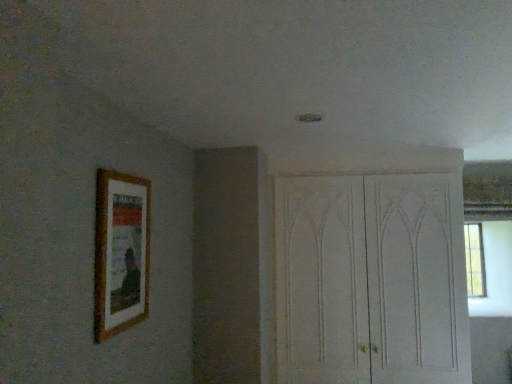
This screenshot has width=512, height=384. Identify the location of white wood dresser at right. (371, 280).

Describe the element at coordinates (371, 280) in the screenshot. I see `white wood dresser at right` at that location.

At what (x,y) coordinates should I click in order to perform the action: click on wooden picture frame at left. Please return your answer as a coordinate pair (x, y). The width and height of the screenshot is (512, 384). Looking at the image, I should click on pyautogui.click(x=121, y=252).

What do you see at coordinates (121, 252) in the screenshot? I see `wooden picture frame at left` at bounding box center [121, 252].

Image resolution: width=512 pixels, height=384 pixels. I want to click on white wood dresser at right, so click(371, 280).

Which is more to the right, wooden picture frame at left or white wood dresser at right?

white wood dresser at right is more to the right.

Is wooden picture frame at left further to the viewer compared to white wood dresser at right?

No, it is in front of white wood dresser at right.

Considering the positions of points (111, 268) and (410, 206), is point (111, 268) closer to camera compared to point (410, 206)?

Yes.

From the image's perspective, is wooden picture frame at left on top of white wood dresser at right?

Yes, from the image's perspective, wooden picture frame at left is over white wood dresser at right.

From a real-world perspective, relative to white wood dresser at right, is wooden picture frame at left vertically above or below?

wooden picture frame at left is situated higher than white wood dresser at right in the real world.

Is wooden picture frame at left wider than white wood dresser at right?

In fact, wooden picture frame at left might be narrower than white wood dresser at right.

Who is shorter, wooden picture frame at left or white wood dresser at right?

wooden picture frame at left is shorter.

Considering the sizes of objects wooden picture frame at left and white wood dresser at right in the image provided, who is bigger, wooden picture frame at left or white wood dresser at right?

white wood dresser at right.

Is white wood dresser at right completely or partially inside wooden picture frame at left?

Actually, white wood dresser at right is outside wooden picture frame at left.

Would you say wooden picture frame at left is a long distance from white wood dresser at right?

wooden picture frame at left is positioned a significant distance from white wood dresser at right.

Based on the photo, could you tell me if wooden picture frame at left is facing white wood dresser at right?

No, wooden picture frame at left is not facing towards white wood dresser at right.

Where is `picture frame above the white wood dresser at right (from a real-world perspective)`? Image resolution: width=512 pixels, height=384 pixels. picture frame above the white wood dresser at right (from a real-world perspective) is located at coordinates (121, 252).

Is white wood dresser at right to the right of wooden picture frame at left from the viewer's perspective?

Yes.

Is white wood dresser at right in front of or behind wooden picture frame at left in the image?

Clearly, white wood dresser at right is behind wooden picture frame at left.

Between point (302, 320) and point (132, 199), which one is positioned behind?

The point (302, 320) is more distant.

From the image's perspective, which is below, white wood dresser at right or wooden picture frame at left?

white wood dresser at right is shown below in the image.

From a real-world perspective, who is located higher, white wood dresser at right or wooden picture frame at left?

wooden picture frame at left, from a real-world perspective.

Which object is wider, white wood dresser at right or wooden picture frame at left?

white wood dresser at right.

Considering the sizes of objects white wood dresser at right and wooden picture frame at left in the image provided, who is taller, white wood dresser at right or wooden picture frame at left?

With more height is white wood dresser at right.

Who is bigger, white wood dresser at right or wooden picture frame at left?

white wood dresser at right.

From the picture: Can wooden picture frame at left be found inside white wood dresser at right?

Actually, wooden picture frame at left is outside white wood dresser at right.

Is white wood dresser at right not close to wooden picture frame at left?

Yes, white wood dresser at right and wooden picture frame at left are located far from each other.

Is white wood dresser at right aimed at wooden picture frame at left?

Yes.

The image size is (512, 384). In order to click on dresser below the wooden picture frame at left (from the image's perspective) in this screenshot , I will do `click(371, 280)`.

At what (x,y) coordinates should I click in order to perform the action: click on dresser below the wooden picture frame at left (from a real-world perspective). Please return your answer as a coordinate pair (x, y). Looking at the image, I should click on (371, 280).

Find the location of a particular element. This screenshot has height=384, width=512. dresser that appears below the wooden picture frame at left (from the image's perspective) is located at coordinates (371, 280).